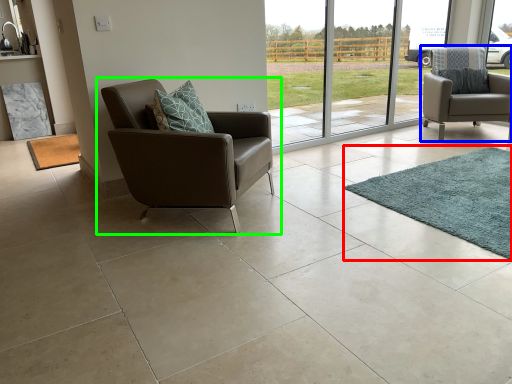
Question: Which object is positioned closest to mat (highlighted by a red box)? Select from chair (highlighted by a blue box) and chair (highlighted by a green box).

Choices:
 (A) chair
 (B) chair

Answer: (B)